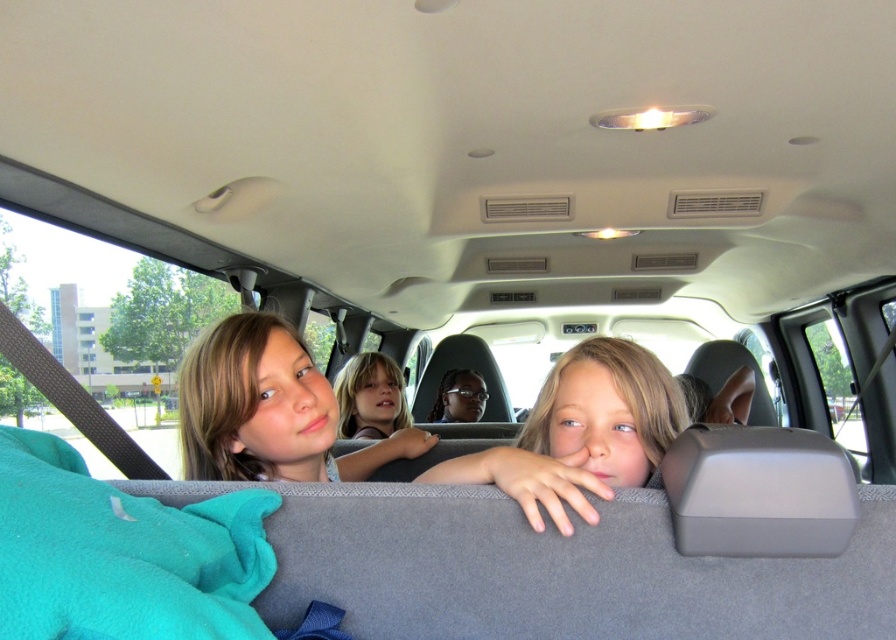
You are sitting in the front passenger seat of the car and want to hand something to the child closest to you. Which of the two points, point 1 at coordinates (197, 406) or point 2 at coordinates (366, 376), is closer to you?

Point 1 at coordinates (197, 406) is closer to you because it is closer to the camera than point 2 at coordinates (366, 376).

Looking at this image, you are a photographer trying to capture a clear photo of the children in the backseat. You notice the blonde hair at center and smooth skin face at center. Which object would appear bigger in the photo?

The blonde hair at center would appear bigger in the photo since it has a larger size compared to the smooth skin face at center.